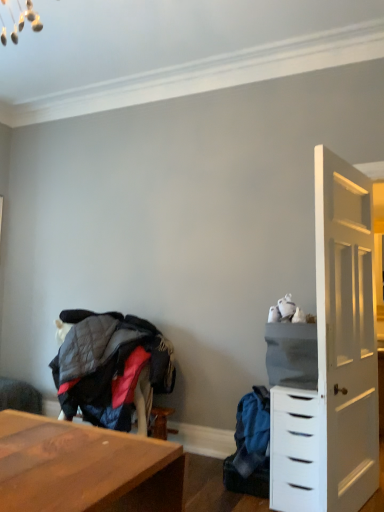
Question: Is gray fabric cabinet at right at the back of quilted fabric jacket at lower left, which is counted as the 1th clothing, starting from the left?

Choices:
 (A) yes
 (B) no

Answer: (B)

Question: Is the position of quilted fabric jacket at lower left, which is counted as the 2th clothing, starting from the right, more distant than that of gray fabric cabinet at right?

Choices:
 (A) no
 (B) yes

Answer: (B)

Question: Is quilted fabric jacket at lower left, which is counted as the 1th clothing, starting from the left, not inside gray fabric cabinet at right?

Choices:
 (A) yes
 (B) no

Answer: (A)

Question: Does quilted fabric jacket at lower left, which is counted as the 1th clothing, starting from the left, appear on the right side of gray fabric cabinet at right?

Choices:
 (A) yes
 (B) no

Answer: (B)

Question: Are quilted fabric jacket at lower left, which is counted as the 2th clothing, starting from the right, and gray fabric cabinet at right located far from each other?

Choices:
 (A) no
 (B) yes

Answer: (B)

Question: Does quilted fabric jacket at lower left, which is counted as the 2th clothing, starting from the right, appear on the left side of gray fabric cabinet at right?

Choices:
 (A) no
 (B) yes

Answer: (B)

Question: Can you confirm if blue fabric backpack at lower right, acting as the first clothing starting from the right, is wider than white matte chest of drawers at right?

Choices:
 (A) yes
 (B) no

Answer: (B)

Question: From a real-world perspective, is blue fabric backpack at lower right, positioned as the second clothing in left-to-right order, beneath white matte chest of drawers at right?

Choices:
 (A) no
 (B) yes

Answer: (B)

Question: Is blue fabric backpack at lower right, positioned as the second clothing in left-to-right order, at the right side of white matte chest of drawers at right?

Choices:
 (A) yes
 (B) no

Answer: (B)

Question: Is blue fabric backpack at lower right, acting as the first clothing starting from the right, positioned behind white matte chest of drawers at right?

Choices:
 (A) yes
 (B) no

Answer: (A)

Question: Can you confirm if blue fabric backpack at lower right, positioned as the second clothing in left-to-right order, is taller than white matte chest of drawers at right?

Choices:
 (A) yes
 (B) no

Answer: (B)

Question: Would you say white matte chest of drawers at right is part of blue fabric backpack at lower right, positioned as the second clothing in left-to-right order,'s contents?

Choices:
 (A) yes
 (B) no

Answer: (B)

Question: From the image's perspective, does white matte chest of drawers at right appear lower than blue fabric backpack at lower right, acting as the first clothing starting from the right?

Choices:
 (A) yes
 (B) no

Answer: (B)